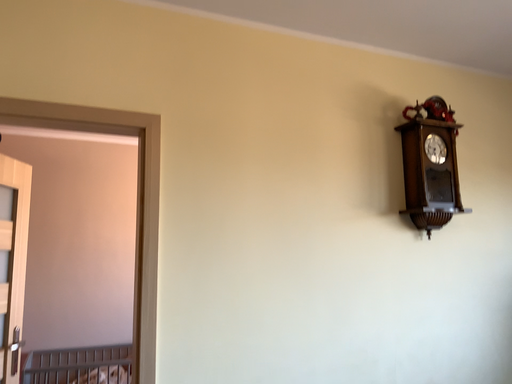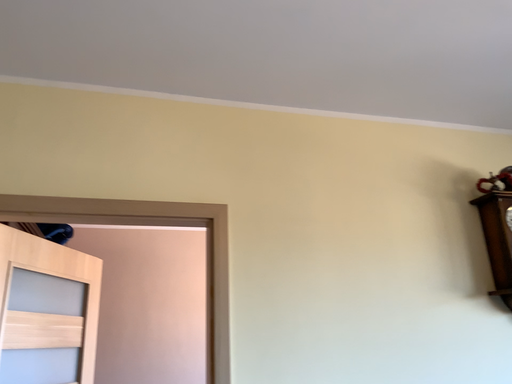
Question: Which way did the camera rotate in the video?

Choices:
 (A) rotated right
 (B) rotated left

Answer: (B)